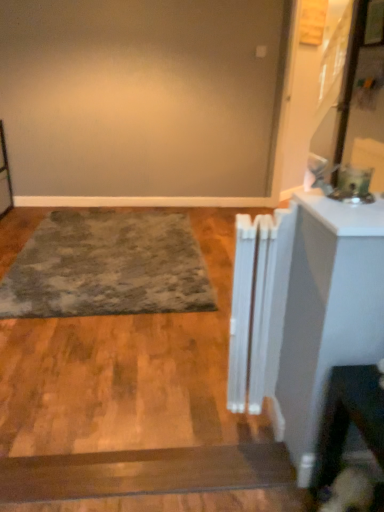
Question: Does textured gray rug at center have a greater width compared to white glossy counter top at right?

Choices:
 (A) no
 (B) yes

Answer: (B)

Question: From the image's perspective, would you say textured gray rug at center is shown under white glossy counter top at right?

Choices:
 (A) yes
 (B) no

Answer: (A)

Question: From the image's perspective, would you say textured gray rug at center is positioned over white glossy counter top at right?

Choices:
 (A) yes
 (B) no

Answer: (B)

Question: Does textured gray rug at center touch white glossy counter top at right?

Choices:
 (A) yes
 (B) no

Answer: (B)

Question: Is textured gray rug at center positioned with its back to white glossy counter top at right?

Choices:
 (A) no
 (B) yes

Answer: (A)

Question: Do you think fuzzy brown dog at lower right is within white glossy counter top at right, or outside of it?

Choices:
 (A) inside
 (B) outside

Answer: (B)

Question: Is fuzzy brown dog at lower right in front of or behind white glossy counter top at right in the image?

Choices:
 (A) front
 (B) behind

Answer: (B)

Question: Considering the relative positions of fuzzy brown dog at lower right and white glossy counter top at right in the image provided, is fuzzy brown dog at lower right to the left or to the right of white glossy counter top at right?

Choices:
 (A) left
 (B) right

Answer: (A)

Question: Is fuzzy brown dog at lower right taller or shorter than white glossy counter top at right?

Choices:
 (A) tall
 (B) short

Answer: (A)

Question: From the image's perspective, is white plastic radiator at center above or below fuzzy brown dog at lower right?

Choices:
 (A) above
 (B) below

Answer: (A)

Question: Looking at their shapes, would you say white plastic radiator at center is wider or thinner than fuzzy brown dog at lower right?

Choices:
 (A) thin
 (B) wide

Answer: (A)

Question: Is white plastic radiator at center to the left or to the right of fuzzy brown dog at lower right in the image?

Choices:
 (A) right
 (B) left

Answer: (B)

Question: Considering their positions, is white plastic radiator at center located in front of or behind fuzzy brown dog at lower right?

Choices:
 (A) front
 (B) behind

Answer: (B)

Question: Is point (238, 375) positioned closer to the camera than point (140, 261)?

Choices:
 (A) farther
 (B) closer

Answer: (B)

Question: From the image's perspective, is white plastic radiator at center above or below textured gray rug at center?

Choices:
 (A) below
 (B) above

Answer: (A)